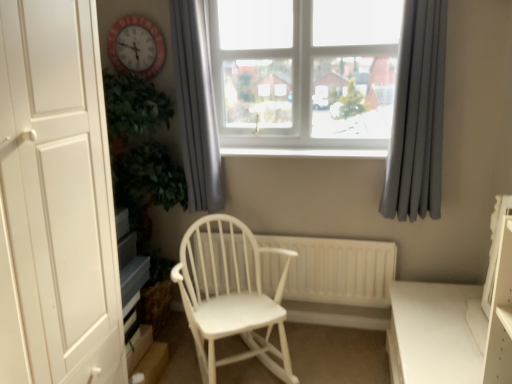
In order to click on empty space that is ontop of white wood at center (from a real-world perspective) in this screenshot , I will do `click(301, 145)`.